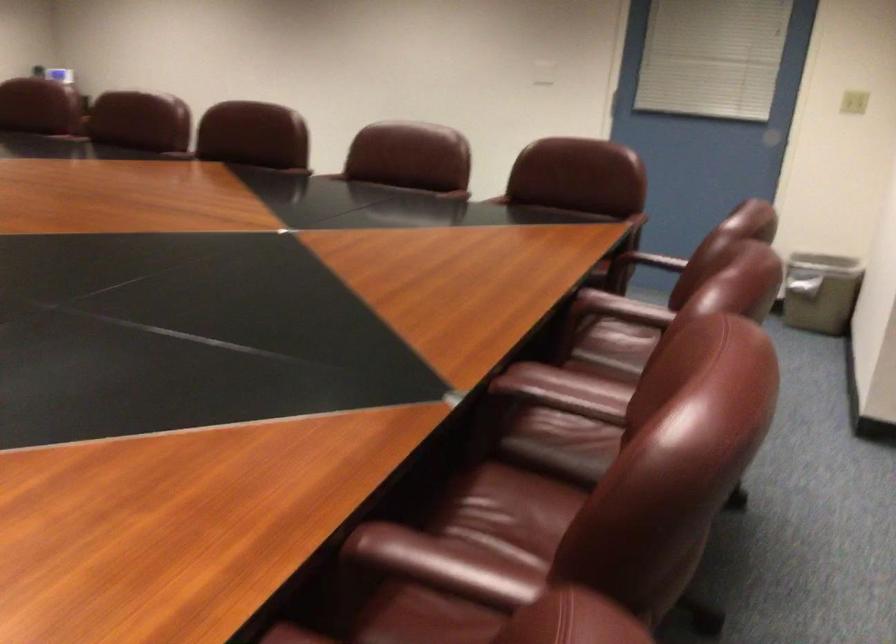
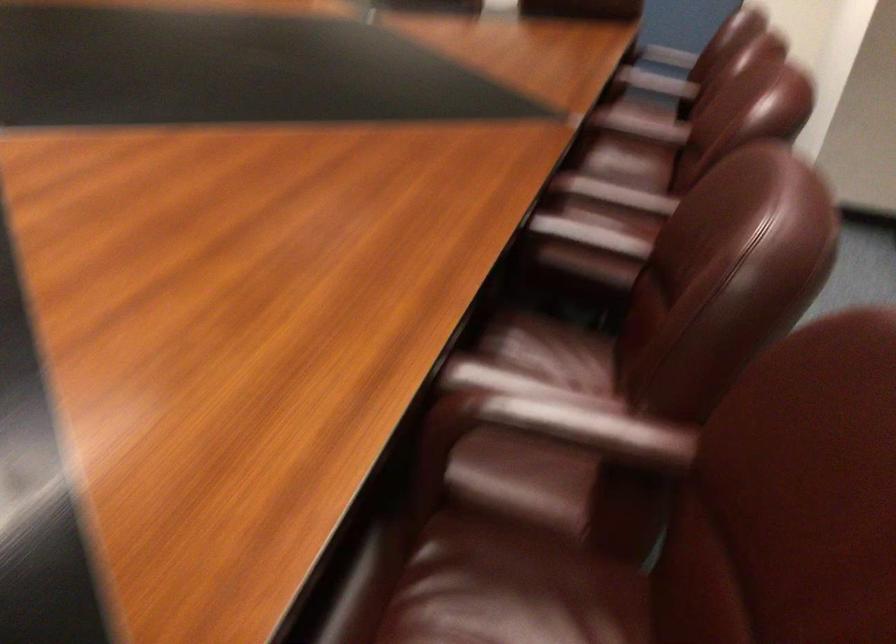
Where in the second image is the point corresponding to (x=621, y=315) from the first image?

(656, 82)